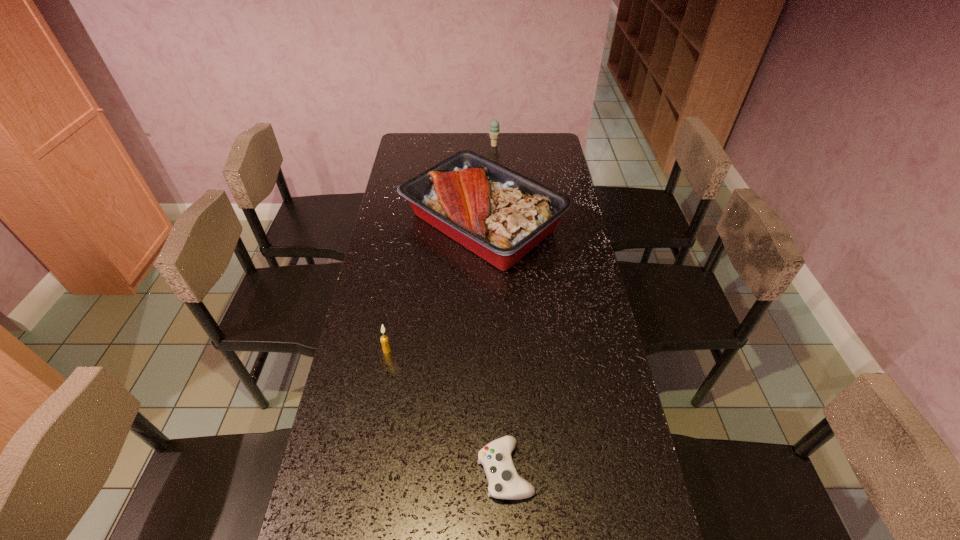
Where is `object at the far edge`? object at the far edge is located at coordinates (494, 132).

Where is `tray at the left edge`? The width and height of the screenshot is (960, 540). tray at the left edge is located at coordinates (500, 215).

Where is `candle that is at the left edge`? The height and width of the screenshot is (540, 960). candle that is at the left edge is located at coordinates (384, 339).

Identify the location of object positioned at the right edge. This screenshot has height=540, width=960. (500, 215).

At what (x,y) coordinates should I click in order to perform the action: click on vacant point at the far edge. Please return your answer as a coordinate pair (x, y). Image resolution: width=960 pixels, height=540 pixels. Looking at the image, I should click on (449, 148).

Image resolution: width=960 pixels, height=540 pixels. In the image, there is a desktop. Identify the location of vacant region at the left edge. (394, 418).

The width and height of the screenshot is (960, 540). Find the location of `vacant space at the right edge of the desktop`. vacant space at the right edge of the desktop is located at coordinates (608, 364).

You are a GUI agent. You are given a task and a screenshot of the screen. Output one action in this format:
    pyautogui.click(x=<x>, y=<y>)
    Task: Click on the blank space at the far left corner of the desktop
    The height and width of the screenshot is (540, 960).
    Given the screenshot: What is the action you would take?
    pyautogui.click(x=414, y=143)

This screenshot has height=540, width=960. Find the location of `vacant area at the far right corner`. vacant area at the far right corner is located at coordinates (552, 139).

Where is `vacant area that lies between the shortest object and the tallest object`? This screenshot has height=540, width=960. vacant area that lies between the shortest object and the tallest object is located at coordinates (493, 346).